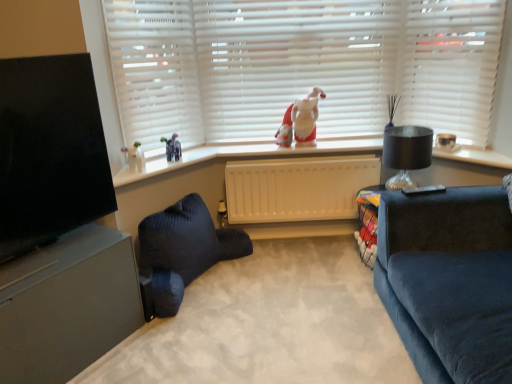
Question: From the image's perspective, is matte black table at right located above or below beige plastic radiator at center?

Choices:
 (A) below
 (B) above

Answer: (A)

Question: Is matte black table at right wider or thinner than beige plastic radiator at center?

Choices:
 (A) thin
 (B) wide

Answer: (B)

Question: Which of these objects is positioned farthest from the white matte blinds at upper left?

Choices:
 (A) matte black table at right
 (B) beige plastic radiator at center
 (C) white matte blinds at upper center, the first blind from the right
 (D) white glossy window sill at upper center
 (E) velvet dark blue pillow at lower left

Answer: (C)

Question: Based on their relative distances, which object is nearer to the beige plastic radiator at center?

Choices:
 (A) white matte blinds at upper center, the first blind in the left-to-right sequence
 (B) velvet dark blue pillow at lower left
 (C) matte black table at right
 (D) white fabric santa at center
 (E) matte gray entertainment center at lower left

Answer: (D)